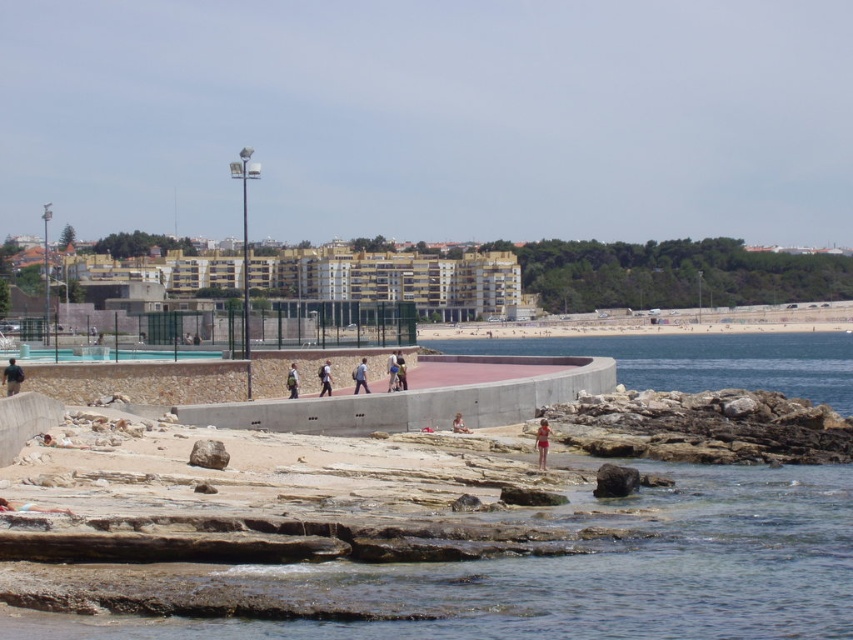
Question: Is dark brown rock at lower right in front of matte black backpack at center?

Choices:
 (A) yes
 (B) no

Answer: (A)

Question: Which point is closer to the camera taking this photo?

Choices:
 (A) (328, 378)
 (B) (404, 365)
 (C) (293, 392)
 (D) (392, 380)

Answer: (C)

Question: Which object appears closest to the camera in this image?

Choices:
 (A) smooth skin person at center
 (B) matte black backpack at center
 (C) red fabric swimsuit at center

Answer: (C)

Question: Which of the following is the closest to the observer?

Choices:
 (A) (451, 426)
 (B) (318, 372)
 (C) (397, 353)

Answer: (A)

Question: Is rocky stone at lower center closer to camera compared to matte blue shirt at center?

Choices:
 (A) no
 (B) yes

Answer: (B)

Question: Observing the image, what is the correct spatial positioning of dark brown rock at lower right in reference to matte black backpack at center?

Choices:
 (A) right
 (B) left

Answer: (A)